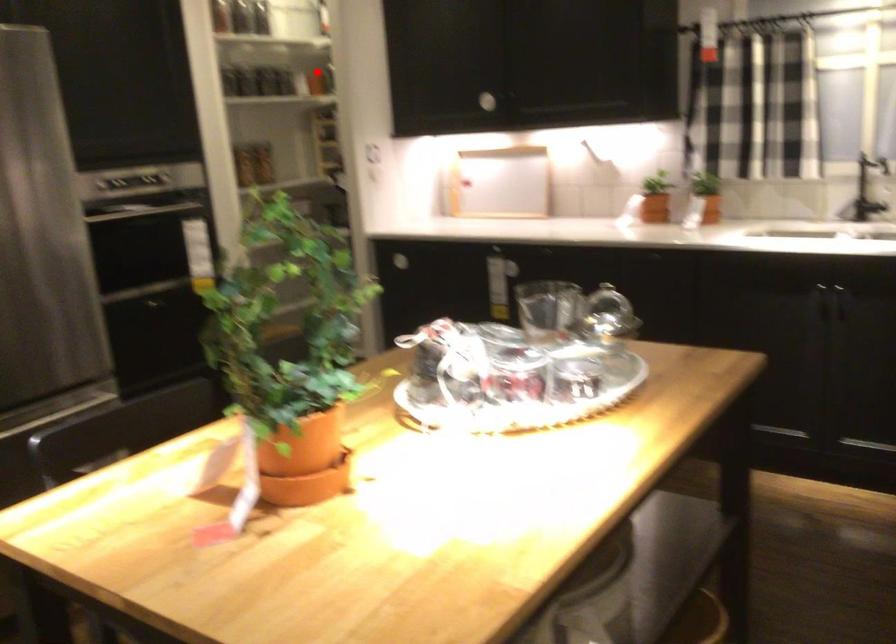
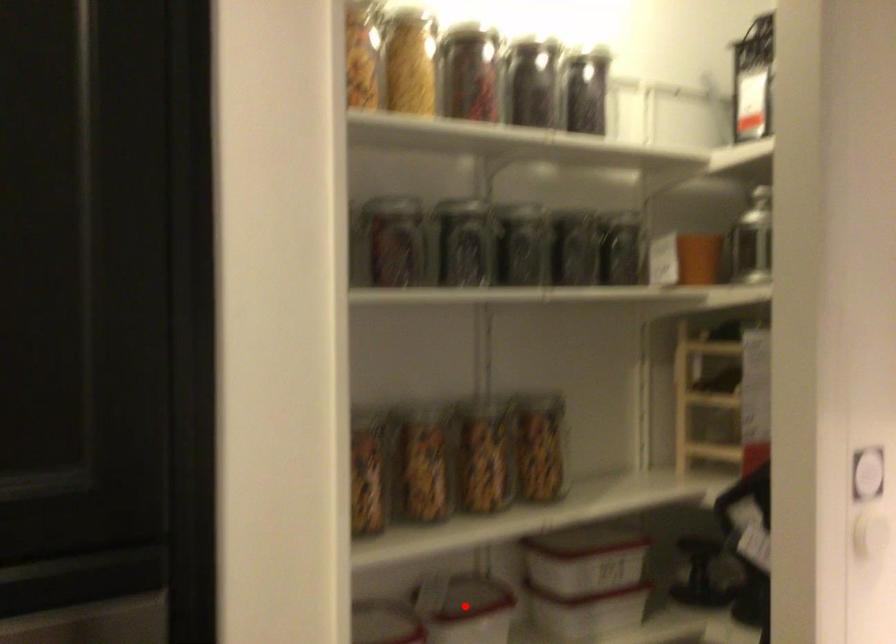
I am providing you with two images of the same scene from different viewpoints. A red point is marked on the first image and another point is marked on the second image. Do the highlighted points in image1 and image2 indicate the same real-world spot?

No